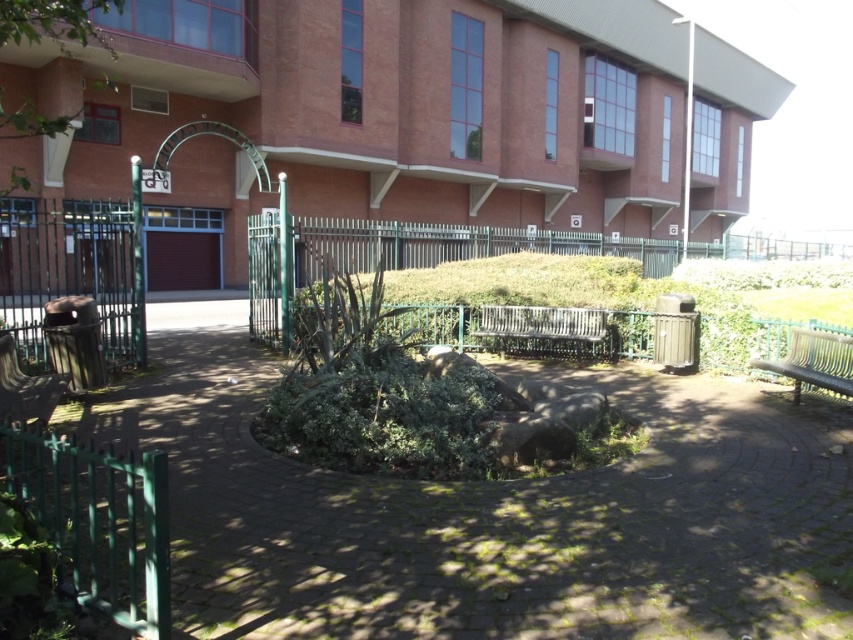
You are a gardener who needs to place a new flower pot that is 1.2 meters in diameter. You have two options for placement on the green cobblestone path at center and the metallic silver bench at center. Based on their sizes, which location would be more suitable for the flower pot?

The green cobblestone path at center has a larger size compared to the metallic silver bench at center, so the flower pot would be more suitable on the green cobblestone path at center.

You are a visitor at the Wallace building and want to sit on the benches. Which bench, the green metal bench at right or the metallic silver bench at center, is positioned higher from the ground?

The metallic silver bench at center is positioned higher from the ground than the green metal bench at right.

You are a visitor at the building and want to sit down. The metallic silver bench at center is your only option. Can you reach it by walking on the green cobblestone path at center?

The green cobblestone path at center is located below the metallic silver bench at center, so you can walk along the green cobblestone path at center to reach the metallic silver bench at center.